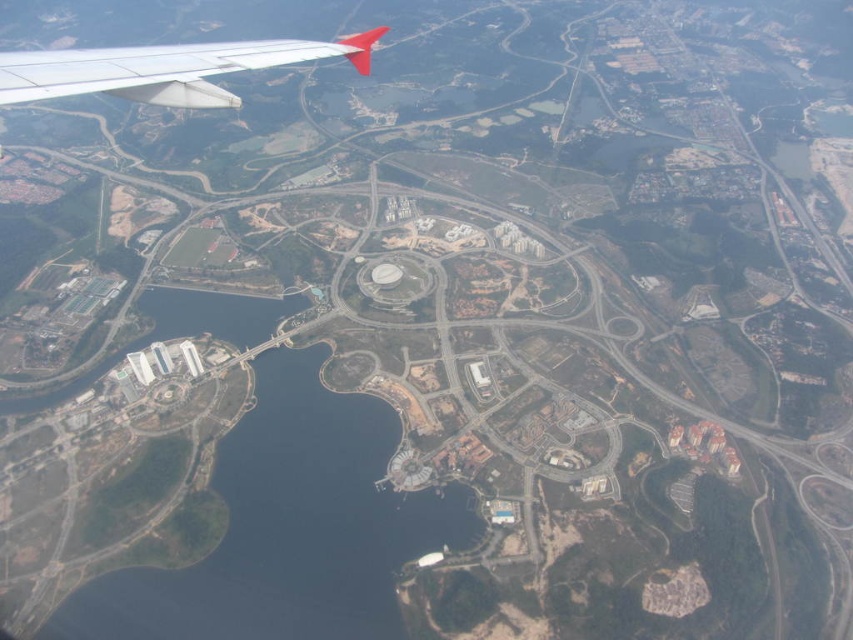
Does blue water at center have a lesser height compared to white matte wing at upper left?

Indeed, blue water at center has a lesser height compared to white matte wing at upper left.

The width and height of the screenshot is (853, 640). Describe the element at coordinates (286, 529) in the screenshot. I see `blue water at center` at that location.

Identify the location of blue water at center. The height and width of the screenshot is (640, 853). (286, 529).